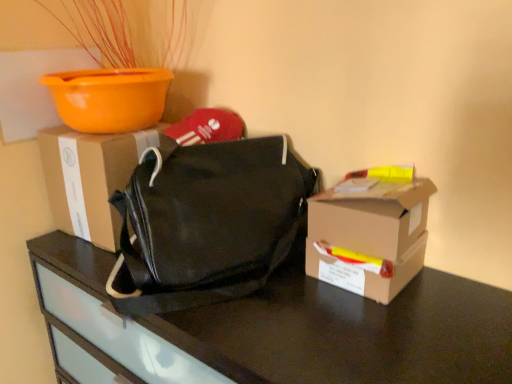
Question: Is brown cardboard box at right, the 1th box in the right-to-left sequence, bigger or smaller than orange plastic bowl at upper left?

Choices:
 (A) small
 (B) big

Answer: (A)

Question: Visually, is brown cardboard box at right, placed as the 2th box when sorted from back to front, positioned to the left or to the right of orange plastic bowl at upper left?

Choices:
 (A) right
 (B) left

Answer: (A)

Question: Estimate the real-world distances between objects in this image. Which object is farther from the black canvas bag at center?

Choices:
 (A) brown cardboard box at right, the 1th box in the right-to-left sequence
 (B) matte cardboard box at center, arranged as the 2th box when viewed from the right
 (C) black matte bag at center
 (D) orange plastic bowl at upper left

Answer: (D)

Question: Based on their relative distances, which object is nearer to the orange plastic bowl at upper left?

Choices:
 (A) matte cardboard box at center, the second box from the front
 (B) brown cardboard box at right, the first box in the front-to-back sequence
 (C) black matte bag at center
 (D) black canvas bag at center

Answer: (A)